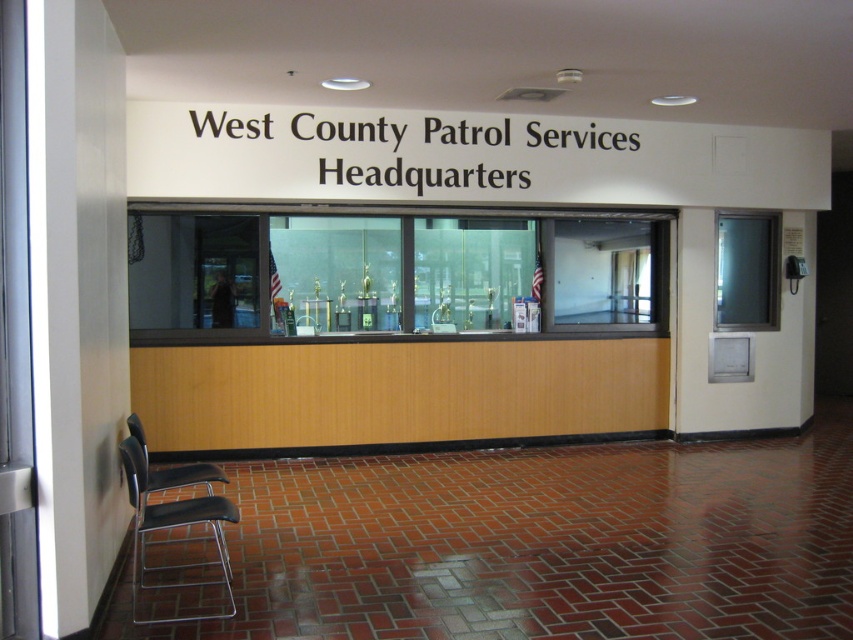
You are a visitor arriving at the West County Patrol Services Headquarters. You see two chairs in the waiting area. Which chair, the black metal chair at lower left or the metallic gray chair at lower left, is closer to the entrance?

The metallic gray chair at lower left is closer to the entrance because the black metal chair at lower left is positioned on the right side of it, meaning the metallic gray chair is to the left and thus nearer to the entrance.

Based on the photo, you are a visitor at the West County Patrol Services Headquarters and need to sit down while waiting. There are two chairs available. Which chair, the black metal chair at lower left or the metallic gray chair at lower left, is located higher up?

The metallic gray chair at lower left is located higher up because the black metal chair at lower left is positioned under it.

You are standing at the entrance of the West County Patrol Services Headquarters. You see two points marked on the floor, point (x=195, y=616) and point (x=212, y=474). Which point is closer to you?

Point (x=195, y=616) is closer to the camera than point (x=212, y=474).